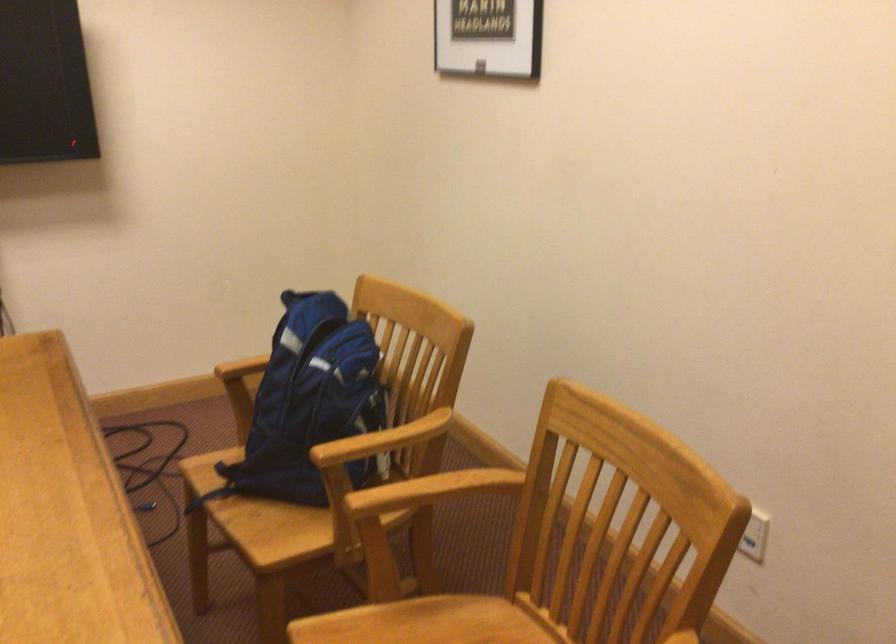
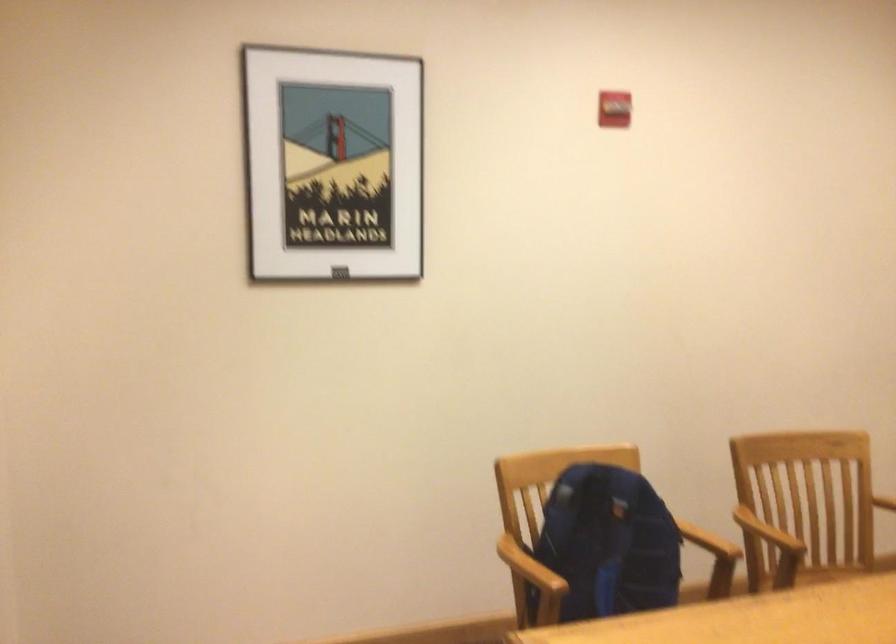
Locate, in the second image, the point that corresponds to pixel 300 381 in the first image.

(607, 544)